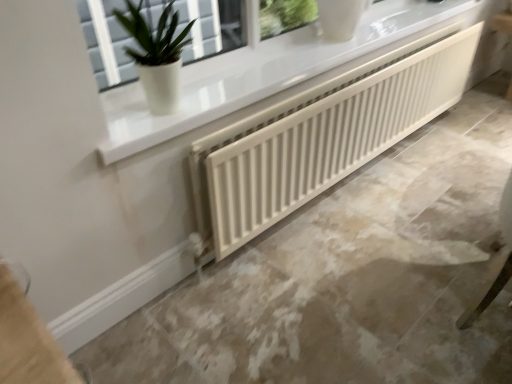
Locate an element on the screen. Image resolution: width=512 pixels, height=384 pixels. free spot above white matte radiator at center (from a real-world perspective) is located at coordinates (394, 197).